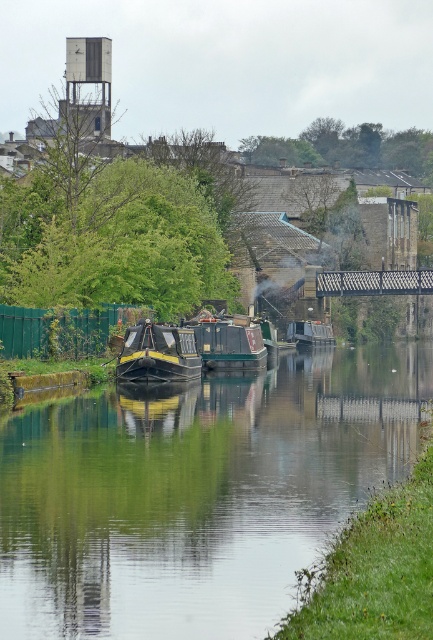
You are a cyclist approaching the metallic grid bridge at center from the left. There is a black polished wood boat at center moving towards the bridge. Will the boat reach the bridge before you?

The black polished wood boat at center is in front of the metallic grid bridge at center, so the boat is already closer to the bridge than the cyclist. Therefore, the boat will reach the bridge before the cyclist.

You are a delivery person needing to cross the canal using the metallic grid bridge at center while avoiding the green wooden boat at center. Can you safely pass through the bridge without hitting the boat?

The green wooden boat at center has a lesser width compared to the metallic grid bridge at center, so yes, you can safely pass through the bridge without hitting the boat since the bridge is wider than the boat.

You are a photographer planning to capture the canal scene. You want to ensure both the black polished wood boat at center and the metallic silver boat at center are fully visible in your shot. Given their sizes, which boat should you position closer to the camera to include both without cropping?

Since the black polished wood boat at center is smaller than the metallic silver boat at center, you should position the black polished wood boat at center closer to the camera to ensure both fit within the frame without cropping.